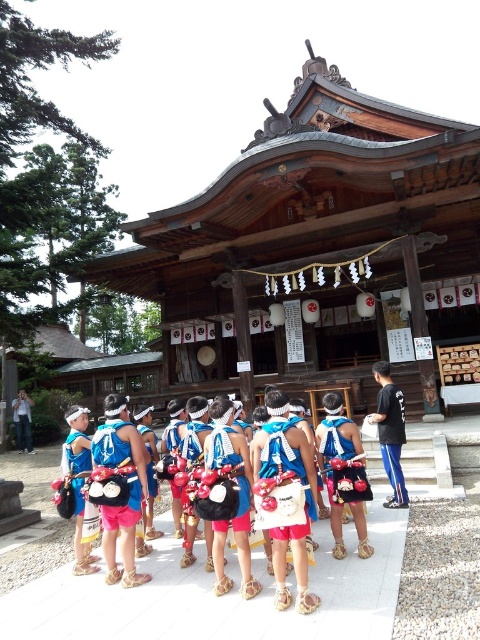
You are a photographer trying to capture the children in the scene. You notice the blue fabric sash at center and the denim jacket at lower left. Which of these two items should you focus on if you want to highlight something smaller in the image?

The blue fabric sash at center has a smaller size compared to the denim jacket at lower left, so you should focus on the blue fabric sash at center to highlight a smaller item in the image.

You are a photographer setting up a shot of the children in front of the shrine. You need to ensure that the blue fabric sash at center and the denim jacket at lower left are both clearly visible in the frame. Based on their positions, which object should you focus on first to ensure both are in focus?

The blue fabric sash at center is taller than the denim jacket at lower left, so focusing on the blue fabric sash at center first will help ensure both objects are in focus since it is the taller object and likely further away.